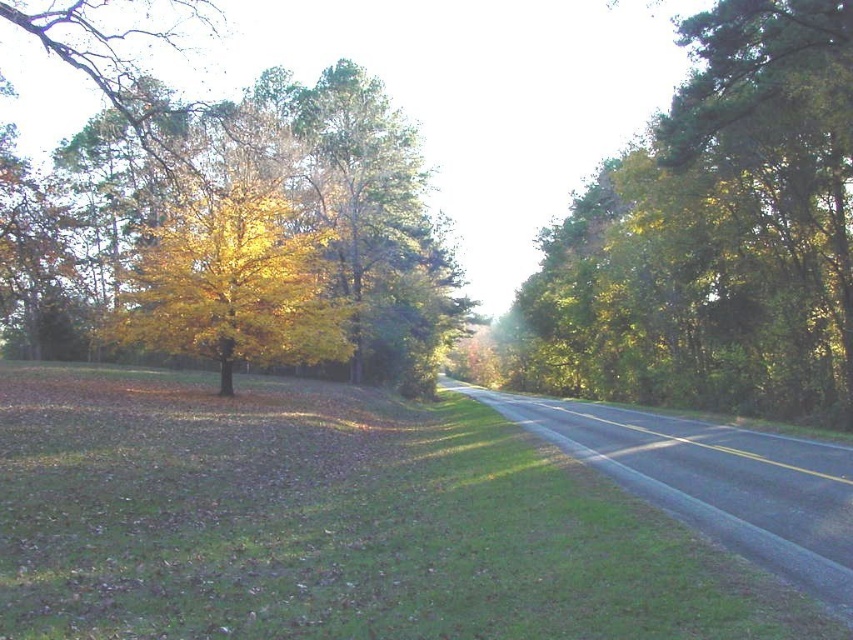
Is point (817, 22) less distant than point (387, 340)?

Yes.

The width and height of the screenshot is (853, 640). What do you see at coordinates (712, 236) in the screenshot?
I see `green leafy tree at right` at bounding box center [712, 236].

This screenshot has width=853, height=640. In order to click on green leafy tree at right in this screenshot , I will do tap(712, 236).